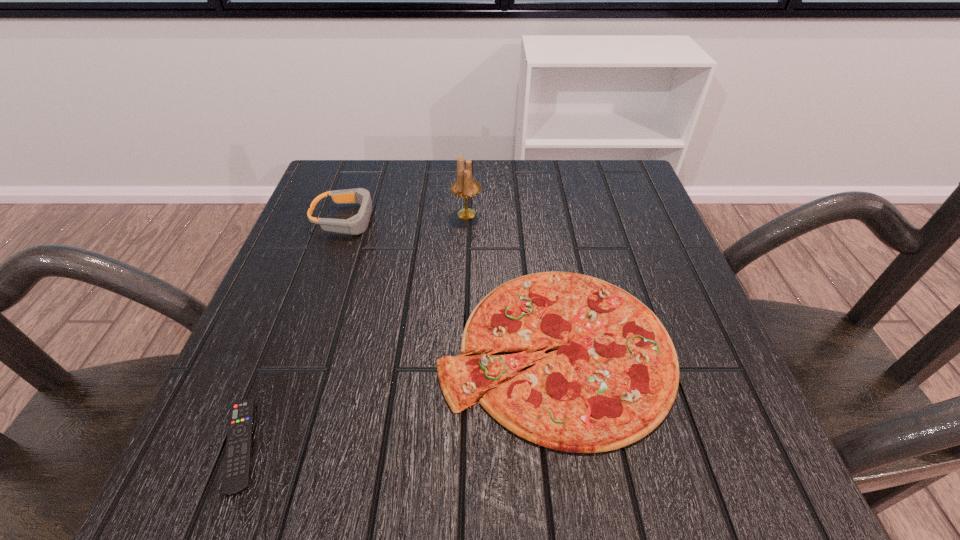
Locate an element on the screen. pizza situated at the near edge is located at coordinates (614, 378).

You are a GUI agent. You are given a task and a screenshot of the screen. Output one action in this format:
    pyautogui.click(x=<x>, y=<y>)
    Task: Click on the remote control that is at the near edge
    The width and height of the screenshot is (960, 540).
    Given the screenshot: What is the action you would take?
    pyautogui.click(x=237, y=465)

What are the coordinates of `goggles at the left edge` in the screenshot? It's located at (357, 224).

At what (x,y) coordinates should I click in order to perform the action: click on remote control positioned at the left edge. Please return your answer as a coordinate pair (x, y). The height and width of the screenshot is (540, 960). Looking at the image, I should click on (237, 465).

Where is `object present at the right edge`? The image size is (960, 540). object present at the right edge is located at coordinates (614, 378).

Locate an element on the screen. The width and height of the screenshot is (960, 540). object that is at the far left corner is located at coordinates (357, 224).

Image resolution: width=960 pixels, height=540 pixels. Find the location of `object situated at the near left corner`. object situated at the near left corner is located at coordinates (237, 465).

Find the location of `object at the near right corner`. object at the near right corner is located at coordinates (614, 378).

The width and height of the screenshot is (960, 540). What are the coordinates of `free space at the far edge` in the screenshot? It's located at (408, 201).

In the image, there is a desktop. Identify the location of free space at the near edge. The height and width of the screenshot is (540, 960). (429, 490).